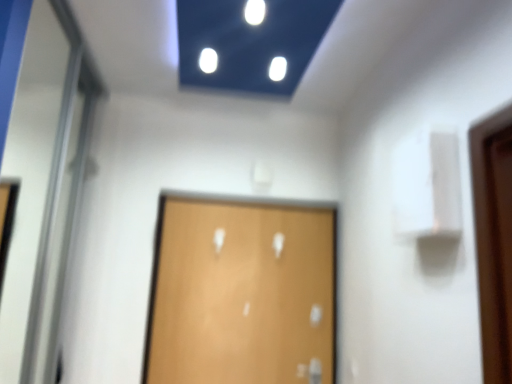
Question: Does wooden door at center have a lesser height compared to white glossy elevator door at left?

Choices:
 (A) yes
 (B) no

Answer: (A)

Question: Does wooden door at center come behind white glossy elevator door at left?

Choices:
 (A) no
 (B) yes

Answer: (B)

Question: Can you confirm if wooden door at center is wider than white glossy elevator door at left?

Choices:
 (A) no
 (B) yes

Answer: (A)

Question: Can you confirm if wooden door at center is taller than white glossy elevator door at left?

Choices:
 (A) yes
 (B) no

Answer: (B)

Question: Is wooden door at center far from white glossy elevator door at left?

Choices:
 (A) yes
 (B) no

Answer: (B)

Question: Considering the relative positions of wooden door at center and white glossy elevator door at left in the image provided, is wooden door at center in front of white glossy elevator door at left?

Choices:
 (A) no
 (B) yes

Answer: (A)

Question: Can you confirm if white glossy elevator door at left is taller than wooden door at center?

Choices:
 (A) yes
 (B) no

Answer: (A)

Question: Is white glossy elevator door at left facing towards wooden door at center?

Choices:
 (A) no
 (B) yes

Answer: (B)

Question: Is white glossy elevator door at left to the right of wooden door at center from the viewer's perspective?

Choices:
 (A) no
 (B) yes

Answer: (A)

Question: Are white glossy elevator door at left and wooden door at center located far from each other?

Choices:
 (A) no
 (B) yes

Answer: (A)

Question: Can we say white glossy elevator door at left lies outside wooden door at center?

Choices:
 (A) yes
 (B) no

Answer: (A)

Question: Is white glossy elevator door at left directly adjacent to wooden door at center?

Choices:
 (A) no
 (B) yes

Answer: (A)

Question: Is point (193, 261) positioned closer to the camera than point (17, 150)?

Choices:
 (A) farther
 (B) closer

Answer: (B)